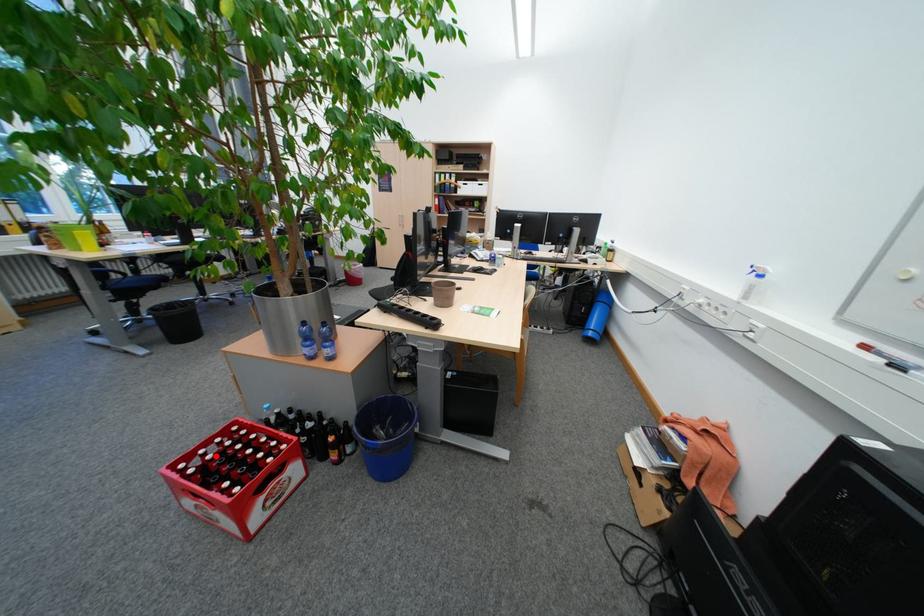
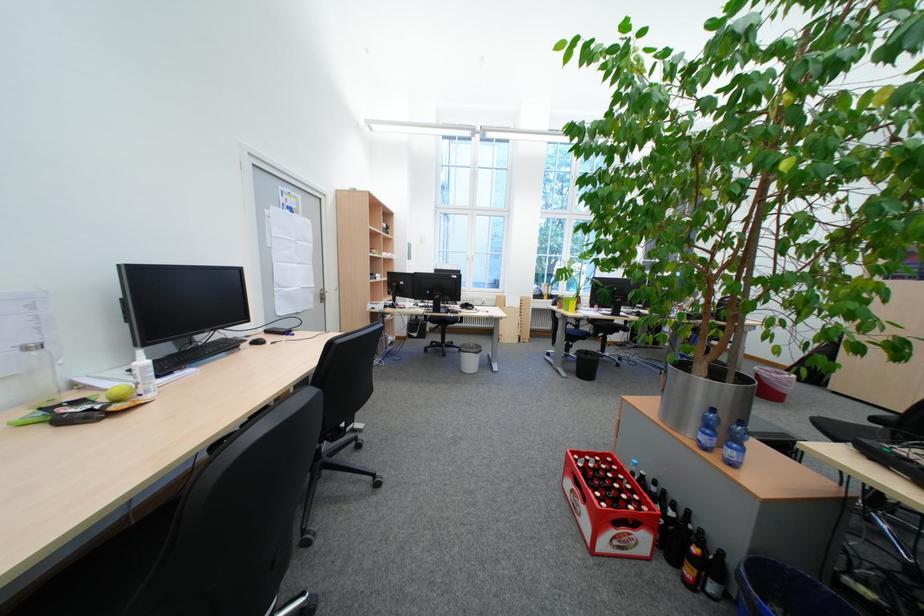
In the second image, find the point that corresponds to the highlighted location in the first image.

(599, 462)